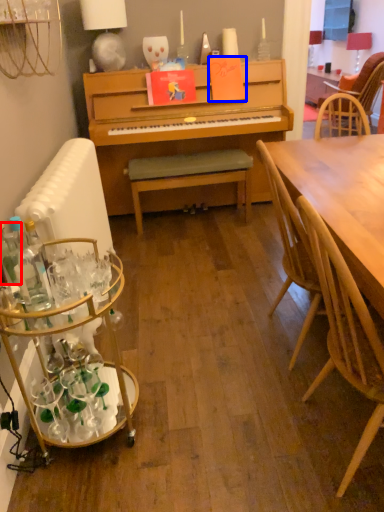
Question: Which object appears closest to the camera in this image, bottle (highlighted by a red box) or book (highlighted by a blue box)?

Choices:
 (A) bottle
 (B) book

Answer: (A)